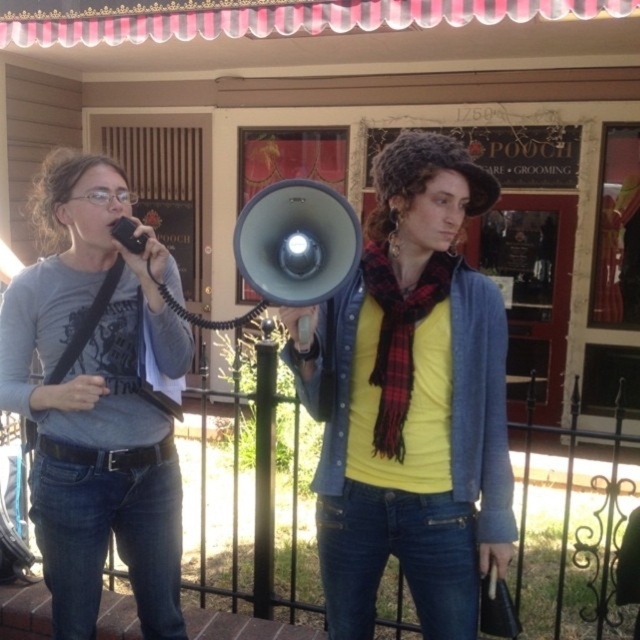
Question: Is matte gray shirt at left to the right of matte gray megaphone at center from the viewer's perspective?

Choices:
 (A) no
 (B) yes

Answer: (A)

Question: Which object is positioned farthest from the matte black megaphone at center?

Choices:
 (A) matte gray megaphone at center
 (B) matte gray shirt at left

Answer: (B)

Question: Which object appears farthest from the camera in this image?

Choices:
 (A) matte black megaphone at center
 (B) matte gray shirt at left

Answer: (B)

Question: Is matte black megaphone at center positioned at the back of matte gray megaphone at center?

Choices:
 (A) no
 (B) yes

Answer: (B)

Question: Which point is farther from the camera taking this photo?

Choices:
 (A) (106, 385)
 (B) (310, 198)

Answer: (A)

Question: Can you confirm if matte black megaphone at center is wider than matte gray megaphone at center?

Choices:
 (A) no
 (B) yes

Answer: (B)